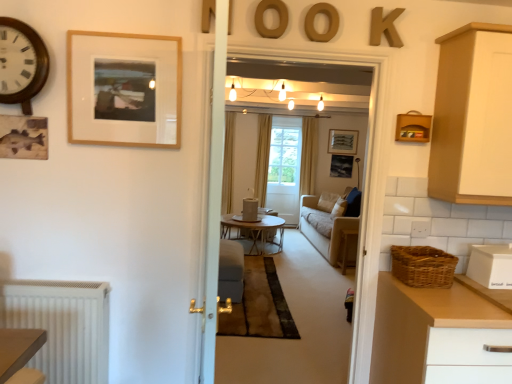
Question: Is the depth of wooden round table at center greater than that of matte black picture frame at center, the third picture frame in the front-to-back sequence?

Choices:
 (A) yes
 (B) no

Answer: (B)

Question: Can you confirm if wooden round table at center is thinner than matte black picture frame at center, the 2th picture frame in the right-to-left sequence?

Choices:
 (A) no
 (B) yes

Answer: (A)

Question: Is wooden round table at center oriented towards matte black picture frame at center, the 2th picture frame in the right-to-left sequence?

Choices:
 (A) no
 (B) yes

Answer: (A)

Question: Does wooden round table at center have a greater width compared to matte black picture frame at center, placed as the 2th picture frame when sorted from left to right?

Choices:
 (A) yes
 (B) no

Answer: (A)

Question: Considering the relative positions of wooden round table at center and matte black picture frame at center, placed as the 2th picture frame when sorted from left to right, in the image provided, is wooden round table at center to the left of matte black picture frame at center, placed as the 2th picture frame when sorted from left to right, from the viewer's perspective?

Choices:
 (A) no
 (B) yes

Answer: (B)

Question: Is woven brown basket at right taller or shorter than wooden clock at upper left?

Choices:
 (A) tall
 (B) short

Answer: (B)

Question: Does point (428, 274) appear closer or farther from the camera than point (30, 43)?

Choices:
 (A) closer
 (B) farther

Answer: (B)

Question: In terms of width, does woven brown basket at right look wider or thinner when compared to wooden clock at upper left?

Choices:
 (A) thin
 (B) wide

Answer: (B)

Question: Would you say woven brown basket at right is to the left or to the right of wooden clock at upper left in the picture?

Choices:
 (A) right
 (B) left

Answer: (A)

Question: From their relative heights in the image, would you say wooden round coffee table at center is taller or shorter than wooden letter k at upper right, the fourth letter in the left-to-right sequence?

Choices:
 (A) short
 (B) tall

Answer: (B)

Question: Considering their positions, is wooden round coffee table at center located in front of or behind wooden letter k at upper right, the fourth letter in the left-to-right sequence?

Choices:
 (A) front
 (B) behind

Answer: (B)

Question: From a real-world perspective, is wooden round coffee table at center physically located above or below wooden letter k at upper right, the first letter in the right-to-left sequence?

Choices:
 (A) above
 (B) below

Answer: (B)

Question: Would you say wooden round coffee table at center is to the left or to the right of wooden letter k at upper right, the fourth letter in the left-to-right sequence, in the picture?

Choices:
 (A) right
 (B) left

Answer: (B)

Question: From the image's perspective, is wooden picture frame at upper left, positioned as the 1th picture frame in left-to-right order, positioned above or below white matte container at right?

Choices:
 (A) above
 (B) below

Answer: (A)

Question: From a real-world perspective, is wooden picture frame at upper left, positioned as the 1th picture frame in left-to-right order, above or below white matte container at right?

Choices:
 (A) above
 (B) below

Answer: (A)